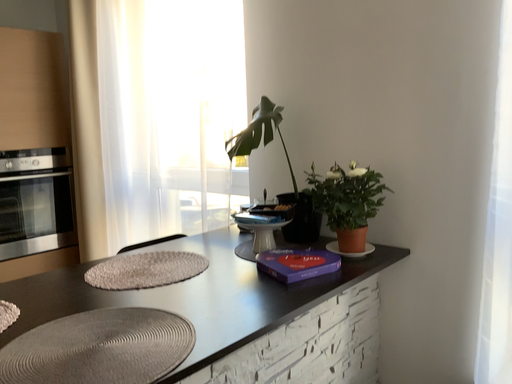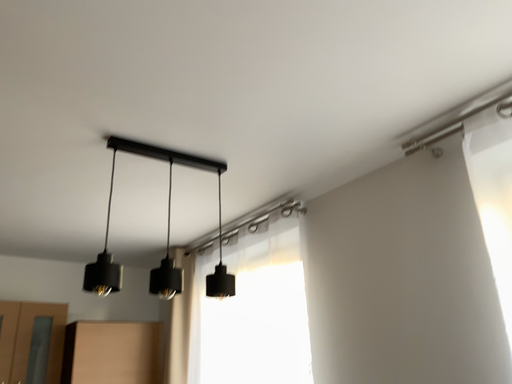
Question: How did the camera likely rotate when shooting the video?

Choices:
 (A) rotated right
 (B) rotated left

Answer: (B)